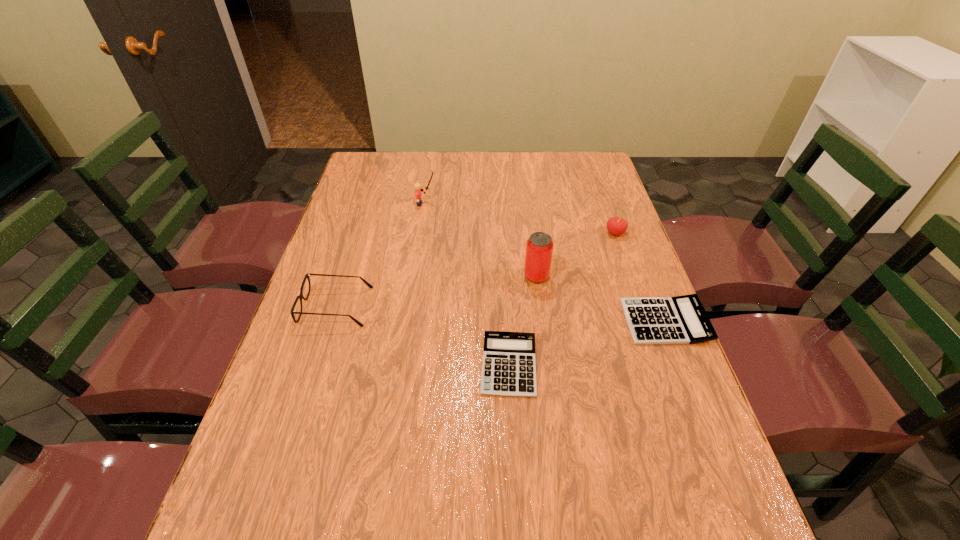
Locate an element on the screen. the second object from left to right is located at coordinates (418, 190).

Find the location of a particular element. The width and height of the screenshot is (960, 540). free space located 0.150m on the front of the shorter calculator is located at coordinates [x=515, y=468].

The image size is (960, 540). In order to click on vacant space located 0.250m on the back of the fifth tallest object in this screenshot , I will do `click(633, 239)`.

You are a GUI agent. You are given a task and a screenshot of the screen. Output one action in this format:
    pyautogui.click(x=<x>, y=<y>)
    Task: Click on the vacant region located 0.140m with the lenses facing outward on the fourth tallest object
    The height and width of the screenshot is (540, 960).
    Given the screenshot: What is the action you would take?
    pyautogui.click(x=423, y=307)

At what (x,y) coordinates should I click in order to perform the action: click on vacant space located on the right of the can. Please return your answer as a coordinate pair (x, y). This screenshot has width=960, height=540. Looking at the image, I should click on (567, 276).

The width and height of the screenshot is (960, 540). Find the location of `vacant space situated 0.110m on the front of the fifth nearest object`. vacant space situated 0.110m on the front of the fifth nearest object is located at coordinates click(626, 264).

Where is `vacant area situated 0.200m on the front-facing side of the Lego`? Image resolution: width=960 pixels, height=540 pixels. vacant area situated 0.200m on the front-facing side of the Lego is located at coordinates point(496,204).

Where is `object at the left edge`? The width and height of the screenshot is (960, 540). object at the left edge is located at coordinates (307, 275).

This screenshot has height=540, width=960. Find the location of `calculator that is at the right edge`. calculator that is at the right edge is located at coordinates (682, 319).

What are the coordinates of `cherry located at the right edge` in the screenshot? It's located at (615, 225).